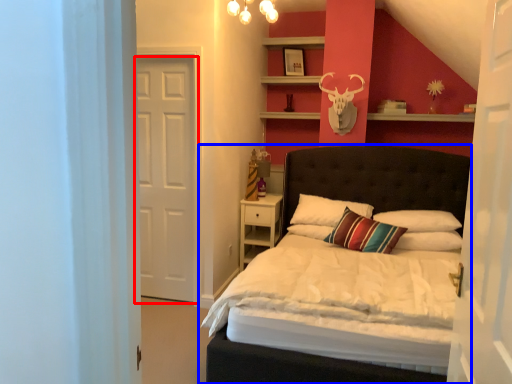
Question: Among these objects, which one is farthest to the camera, door (highlighted by a red box) or bed (highlighted by a blue box)?

Choices:
 (A) door
 (B) bed

Answer: (A)